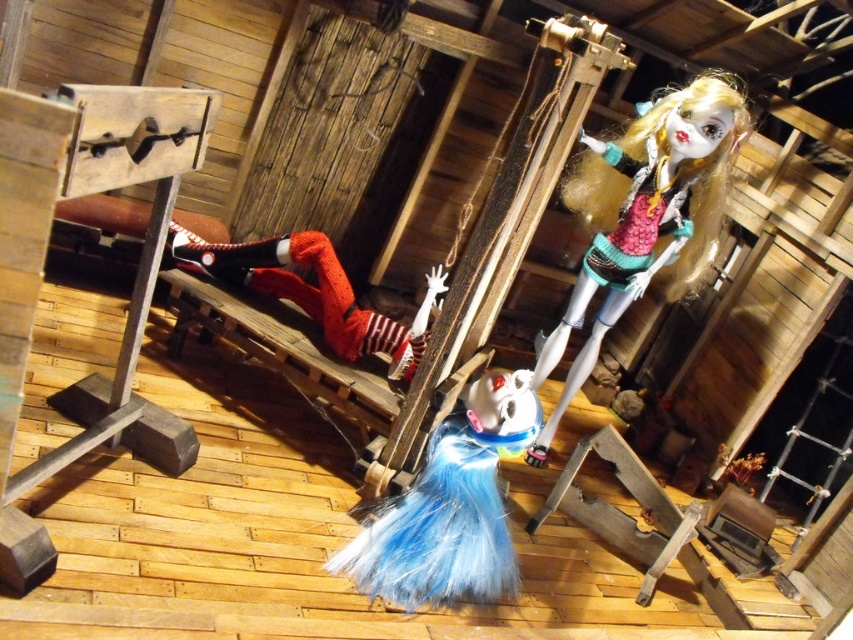
You are an interior designer planning to place a new shelf in this rustic wooden structure. The shiny teal fabric doll at upper right and the matte red plush doll at center are both displayed on the shelf. Which doll requires a wider shelf space?

The matte red plush doll at center requires a wider shelf space because its width is greater than the shiny teal fabric doll at upper right.

You are a visitor in this dimly lit rustic wooden structure. You see the shiny teal fabric doll at upper right and the blue fuzzy doll at center. Which doll is closer to you?

The shiny teal fabric doll at upper right is closer to you because the blue fuzzy doll at center is behind it.

You are a visitor in this dimly lit rustic wooden structure. You see a blue fuzzy doll at center and a matte red plush doll at center. Which one is positioned to the right side?

The blue fuzzy doll at center is positioned to the right of the matte red plush doll at center.